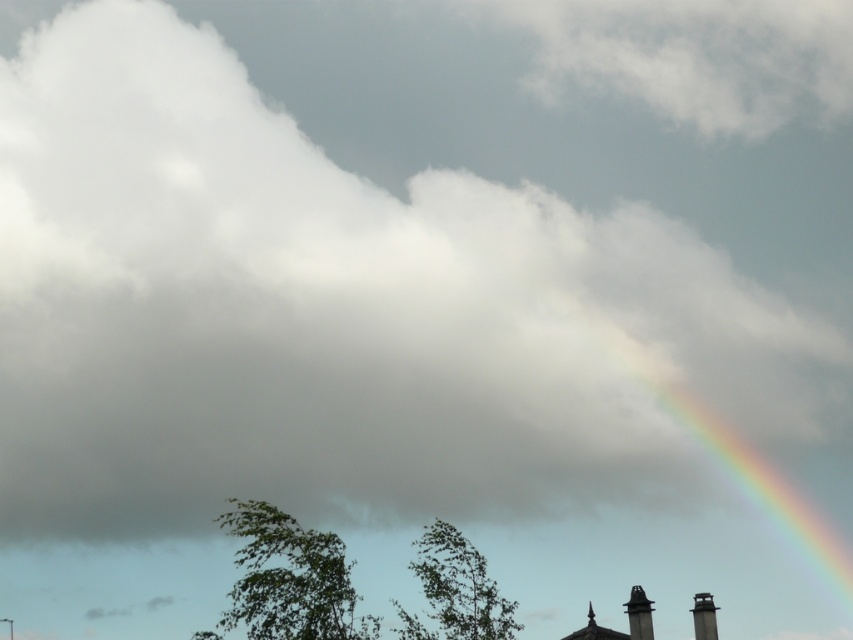
Question: Is green leafy tree at center wider than black matte chimney at lower right?

Choices:
 (A) yes
 (B) no

Answer: (A)

Question: Considering the real-world distances, which object is closest to the black matte chimney at lower right?

Choices:
 (A) rainbow at upper right
 (B) green leafy tree at center

Answer: (A)

Question: Does green leafy tree at center have a smaller size compared to black matte chimney at lower right?

Choices:
 (A) yes
 (B) no

Answer: (B)

Question: Which point is farther to the camera?

Choices:
 (A) (428, 531)
 (B) (706, 604)
 (C) (799, 509)

Answer: (C)

Question: Is green leafy tree at center further to camera compared to black matte chimney at lower right?

Choices:
 (A) no
 (B) yes

Answer: (A)

Question: Which of the following is the closest to the observer?

Choices:
 (A) (693, 620)
 (B) (247, 604)

Answer: (B)